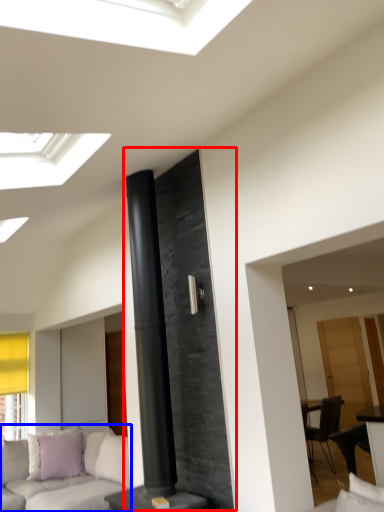
Question: Which object appears farthest to the camera in this image, fireplace (highlighted by a red box) or studio couch (highlighted by a blue box)?

Choices:
 (A) fireplace
 (B) studio couch

Answer: (B)